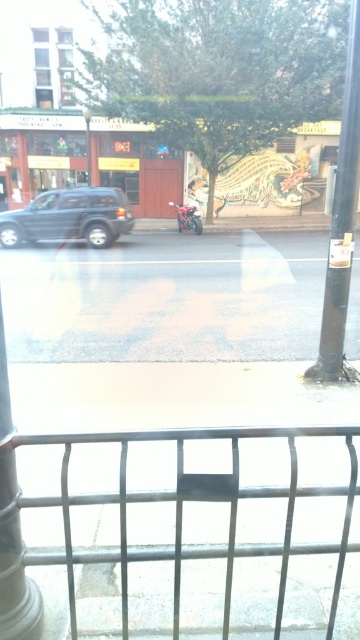
Is metallic silver fence at lower center thinner than shiny red motorcycle at center?

In fact, metallic silver fence at lower center might be wider than shiny red motorcycle at center.

Is point (349, 502) behind point (201, 225)?

No, (349, 502) is closer to viewer.

Identify the location of metallic silver fence at lower center. (195, 499).

Can you confirm if metallic silver fence at lower center is shorter than white glossy pillar at lower left?

Indeed, metallic silver fence at lower center has a lesser height compared to white glossy pillar at lower left.

This screenshot has height=640, width=360. I want to click on metallic silver fence at lower center, so click(195, 499).

This screenshot has width=360, height=640. In order to click on metallic silver fence at lower center in this screenshot , I will do `click(195, 499)`.

Who is higher up, black metal pole at right or metallic pole at center?

metallic pole at center is above.

Which is in front, point (351, 180) or point (87, 108)?

Point (351, 180) is in front.

You are a GUI agent. You are given a task and a screenshot of the screen. Output one action in this format:
    pyautogui.click(x=<x>, y=<y>)
    Task: Click on the black metal pole at right
    
    Given the screenshot: What is the action you would take?
    pyautogui.click(x=342, y=225)